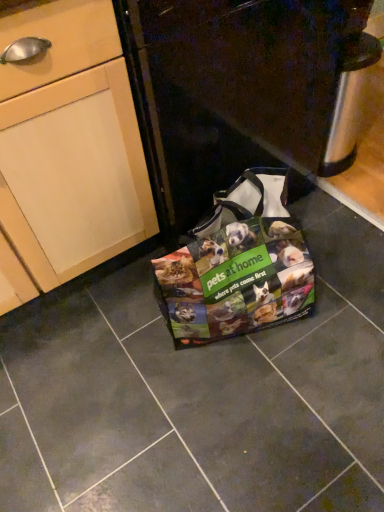
The height and width of the screenshot is (512, 384). In order to click on free space in front of black glossy refrigerator at center in this screenshot , I will do `click(213, 349)`.